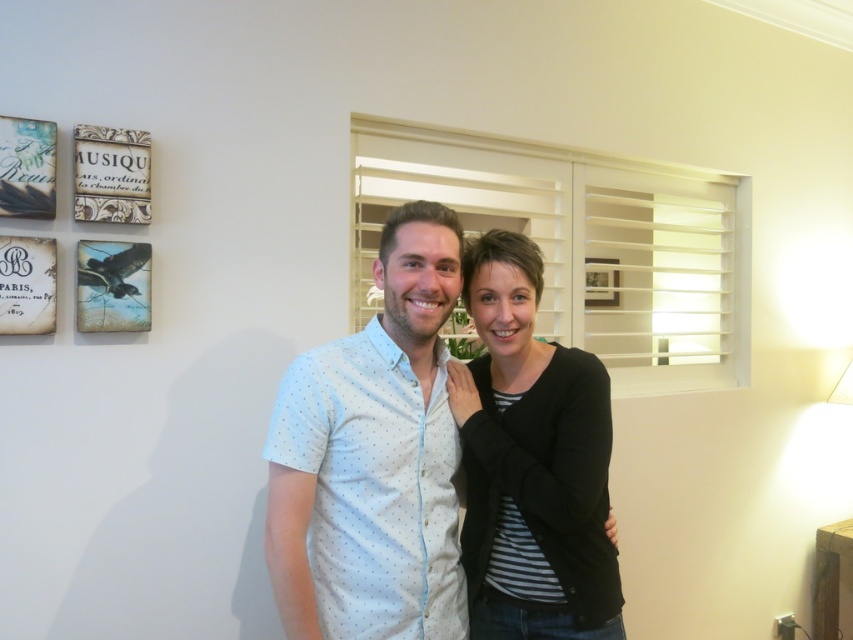
Can you confirm if black matte jacket at center is wider than wooden picture frame at center?

Correct, the width of black matte jacket at center exceeds that of wooden picture frame at center.

Is black matte jacket at center smaller than wooden picture frame at center?

Incorrect, black matte jacket at center is not smaller in size than wooden picture frame at center.

Where is `black matte jacket at center`? This screenshot has width=853, height=640. black matte jacket at center is located at coordinates (531, 461).

Locate an element on the screen. This screenshot has height=640, width=853. black matte jacket at center is located at coordinates (531, 461).

Between point (271, 476) and point (479, 538), which one is positioned behind?

The point (479, 538) is more distant.

Where is `white dotted shirt at center`? This screenshot has height=640, width=853. white dotted shirt at center is located at coordinates (373, 458).

At what (x,y) coordinates should I click in order to perform the action: click on white dotted shirt at center. Please return your answer as a coordinate pair (x, y). The height and width of the screenshot is (640, 853). Looking at the image, I should click on (373, 458).

Is point (428, 243) farther from camera compared to point (616, 300)?

No.

Can you confirm if white dotted shirt at center is positioned to the right of wooden picture frame at center?

Incorrect, white dotted shirt at center is not on the right side of wooden picture frame at center.

Find the location of a particular element. Image resolution: width=853 pixels, height=640 pixels. white dotted shirt at center is located at coordinates (373, 458).

The image size is (853, 640). I want to click on white dotted shirt at center, so click(x=373, y=458).